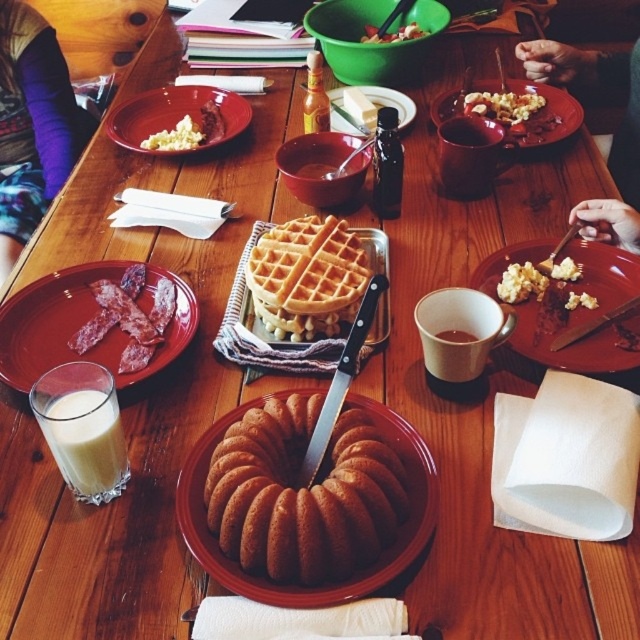
You are setting up a table for a dinner party and need to place a centerpiece. You have the purple fabric at upper left and the smooth plastic bowl at center. Which object should you move to make space for the centerpiece, and why?

You should move the purple fabric at upper left because it is currently in front of the smooth plastic bowl at center, so moving it would free up space behind it for the centerpiece.

You are a chef standing at the edge of the table where the brown glazed bundt cake at center is placed. You need to reach the cake to serve a slice. Considering your arm can extend 20 inches, will you be able to reach the cake?

The brown glazed bundt cake at center is 22.23 inches away from the viewer. Since your arm can only extend 20 inches, you won not be able to reach the cake.

You are setting up a table for a dinner party and need to place a tall centerpiece. The purple fabric at upper left and the smooth plastic bowl at center are available. Which object should you choose to ensure it stands out more in height?

The purple fabric at upper left is much taller than the smooth plastic bowl at center, so it would stand out more in height and be suitable for a tall centerpiece.